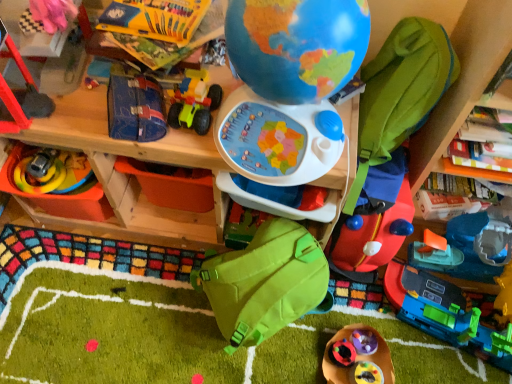
The image size is (512, 384). In order to click on vacant area that is situated to the right of rubberized red ladder at left, which appears as the 10th toy when viewed from the right in this screenshot , I will do `click(70, 121)`.